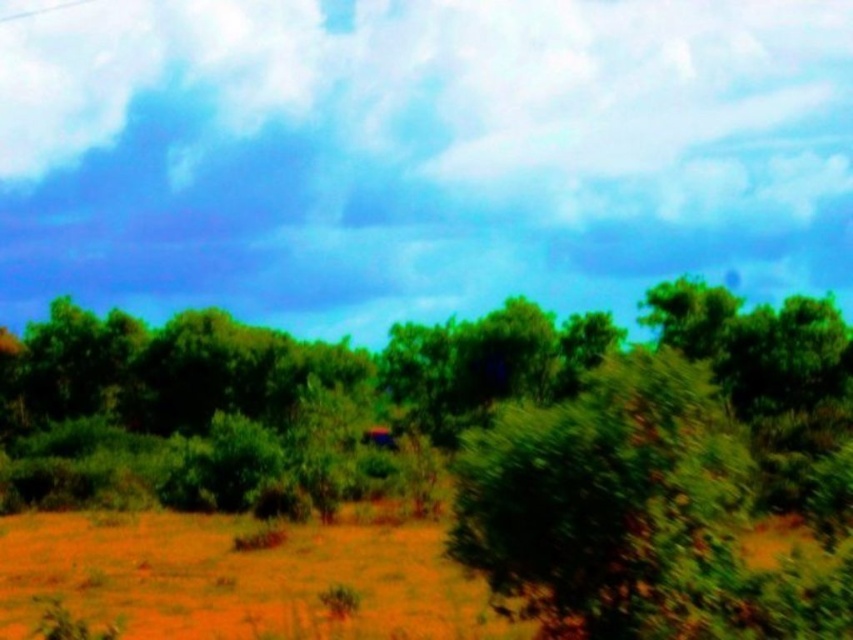
You are a hiker trying to cross the brown sandy dirt field at lower left and reach the green leafy tree at center. Considering the widths of both, which path should you take to ensure you have enough space to walk comfortably?

The green leafy tree at center is wider than the brown sandy dirt field at lower left, so you should take the path through the brown sandy dirt field at lower left since it is narrower and offers a more direct route with sufficient space for walking.